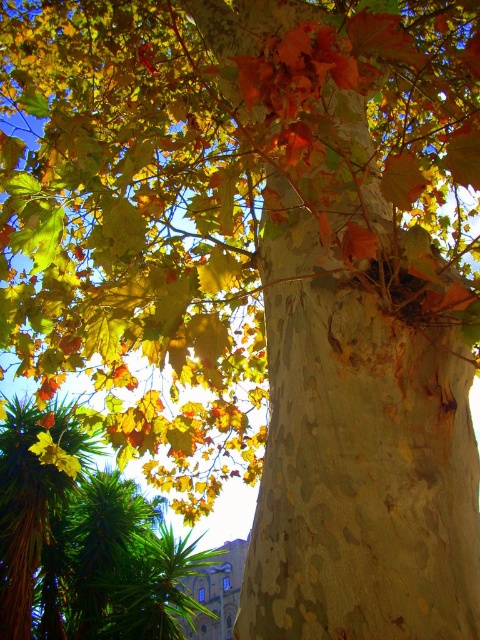
Is green leafy palm at lower left in front of green leafy palm at upper left?

No.

Does green leafy palm at lower left have a lesser height compared to green leafy palm at upper left?

Indeed, green leafy palm at lower left has a lesser height compared to green leafy palm at upper left.

You are a GUI agent. You are given a task and a screenshot of the screen. Output one action in this format:
    pyautogui.click(x=<x>, y=<y>)
    Task: Click on the green leafy palm at lower left
    The height and width of the screenshot is (640, 480).
    Given the screenshot: What is the action you would take?
    pyautogui.click(x=94, y=556)

Locate an element on the screen. The image size is (480, 640). green leafy palm at lower left is located at coordinates (94, 556).